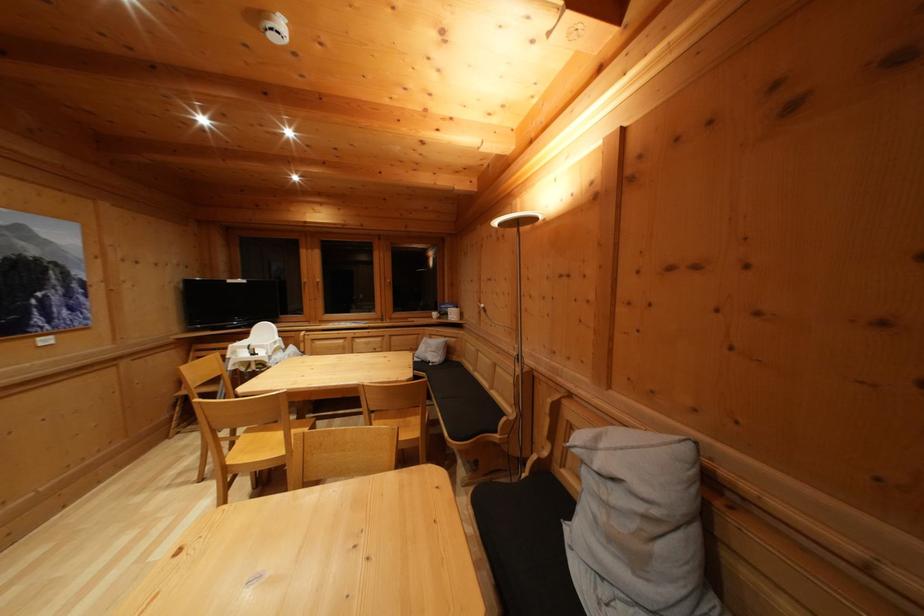
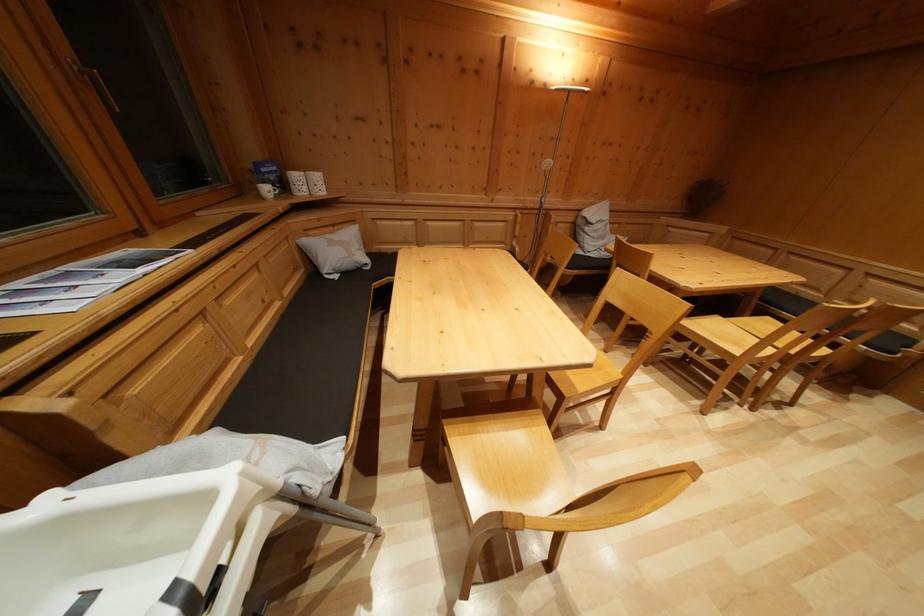
Find the pixel in the second image that matches point 451,344 in the first image.

(338, 233)